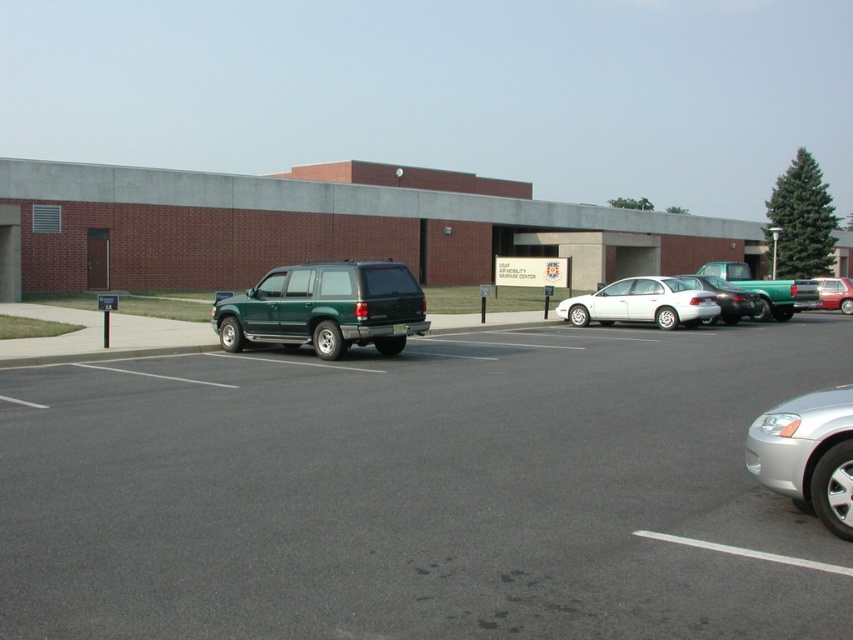
Question: Which point is closer to the camera taking this photo?

Choices:
 (A) (814, 474)
 (B) (189, 440)
 (C) (773, 314)

Answer: (A)

Question: From the image, what is the correct spatial relationship of green matte suv at center-left in relation to shiny black sedan at center?

Choices:
 (A) above
 (B) below

Answer: (B)

Question: Is silver metallic sedan at lower right thinner than green matte truck at right?

Choices:
 (A) no
 (B) yes

Answer: (B)

Question: Does white glossy sedan at center have a smaller size compared to shiny black sedan at center?

Choices:
 (A) yes
 (B) no

Answer: (B)

Question: Which point is closer to the camera?

Choices:
 (A) green matte suv at center-left
 (B) green matte truck at right
 (C) silver metallic sedan at lower right

Answer: (A)

Question: Which object is the closest to the green matte suv at center-left?

Choices:
 (A) green matte suv at center
 (B) shiny black sedan at center

Answer: (A)